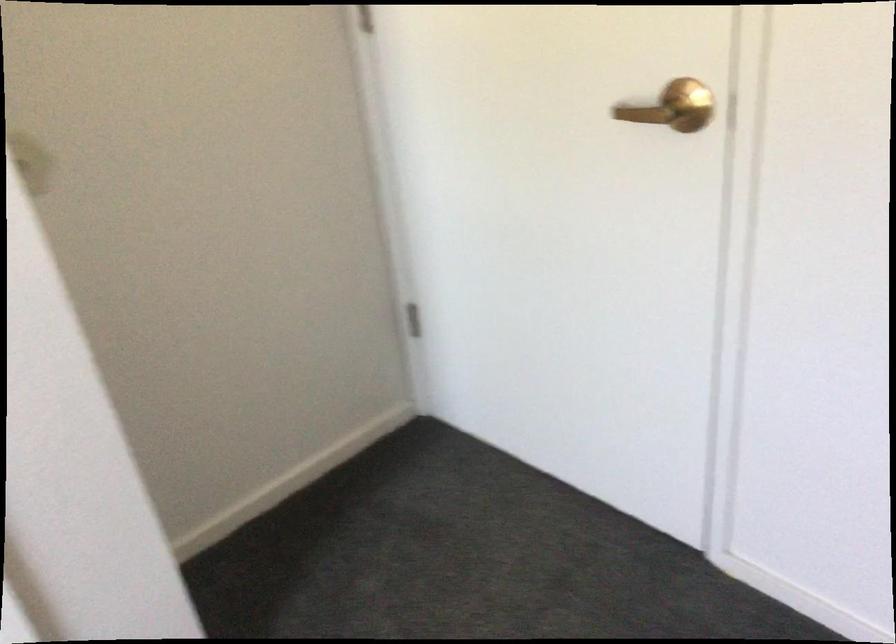
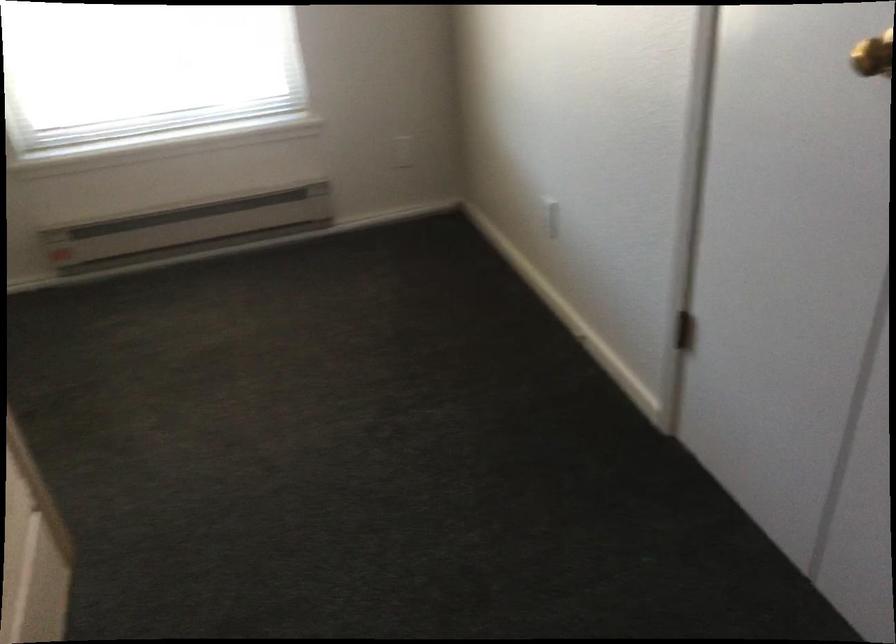
The first image is from the beginning of the video and the second image is from the end. How did the camera likely rotate when shooting the video?

The camera's rotation is toward left-down.